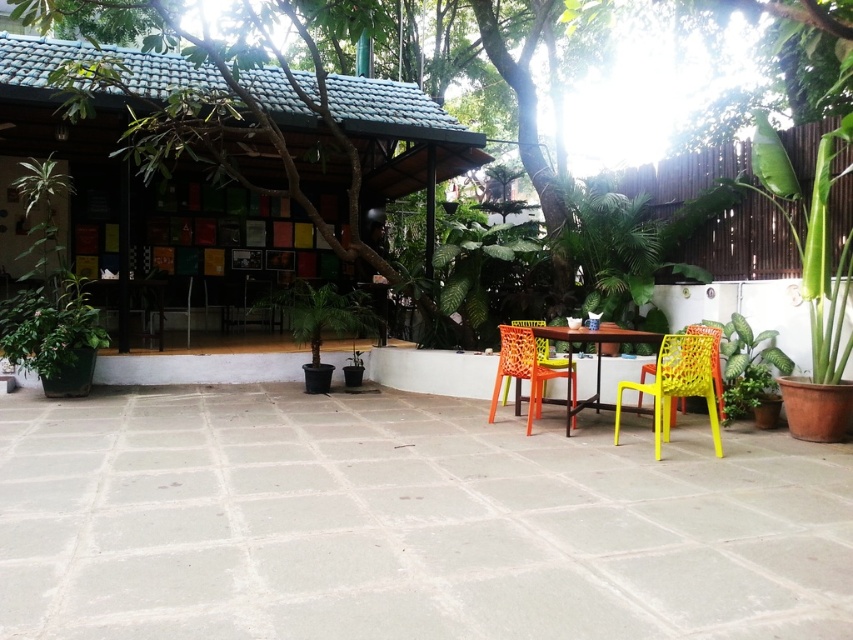
You are standing at the entrance of the patio and want to sit down in the orange mesh chair at center. Based on the coordinates provided, in which direction should you walk to reach it?

The orange mesh chair at center is located at coordinates point [525,369], so you should walk forward and slightly to the right to reach it.

You are planning to place a large potted plant on the metallic yellow table at center. Considering the size of the yellow mesh chair at lower right, will the plant fit on the table?

The yellow mesh chair at lower right is smaller than the metallic yellow table at center, so the table likely has enough space to accommodate the large potted plant.